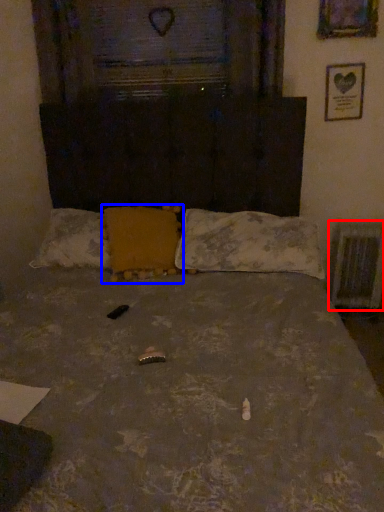
Question: Among these objects, which one is nearest to the camera, radiator (highlighted by a red box) or pillow (highlighted by a blue box)?

Choices:
 (A) radiator
 (B) pillow

Answer: (B)